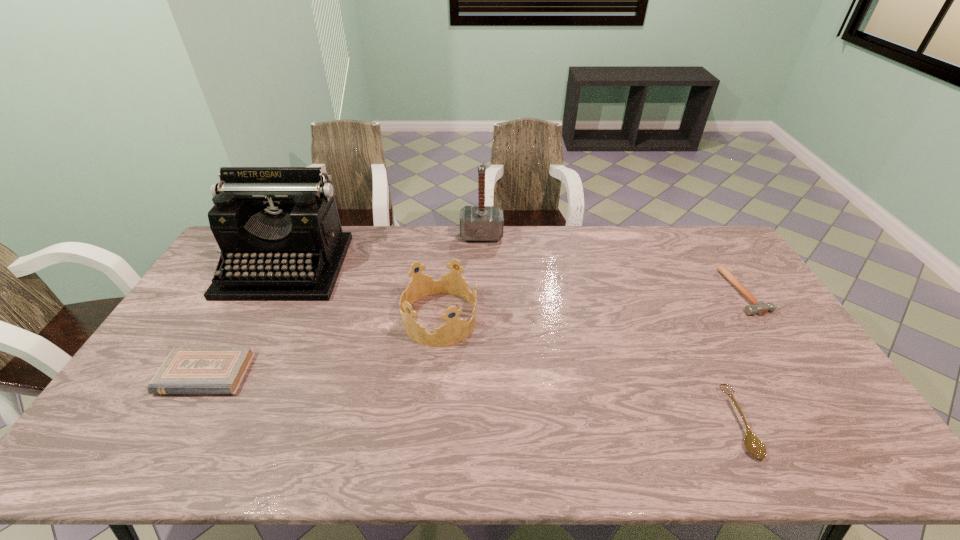
Locate an element on the screen. This screenshot has width=960, height=540. typewriter is located at coordinates (278, 228).

The width and height of the screenshot is (960, 540). Find the location of `the left hammer`. the left hammer is located at coordinates (477, 223).

Identify the location of the farther hammer. The width and height of the screenshot is (960, 540). (477, 223).

This screenshot has width=960, height=540. I want to click on the third tallest object, so click(x=455, y=330).

Where is `Bible`? This screenshot has width=960, height=540. Bible is located at coordinates (187, 369).

In order to click on the right hammer in this screenshot , I will do `click(761, 308)`.

Locate an element on the screen. The image size is (960, 540). the shorter hammer is located at coordinates (761, 308).

Image resolution: width=960 pixels, height=540 pixels. I want to click on the fifth object from left to right, so click(x=754, y=446).

Where is `ladle`? Image resolution: width=960 pixels, height=540 pixels. ladle is located at coordinates (754, 446).

Find the location of a particular element. The width and height of the screenshot is (960, 540). vacant space situated 0.160m on the typing side of the typewriter is located at coordinates (249, 339).